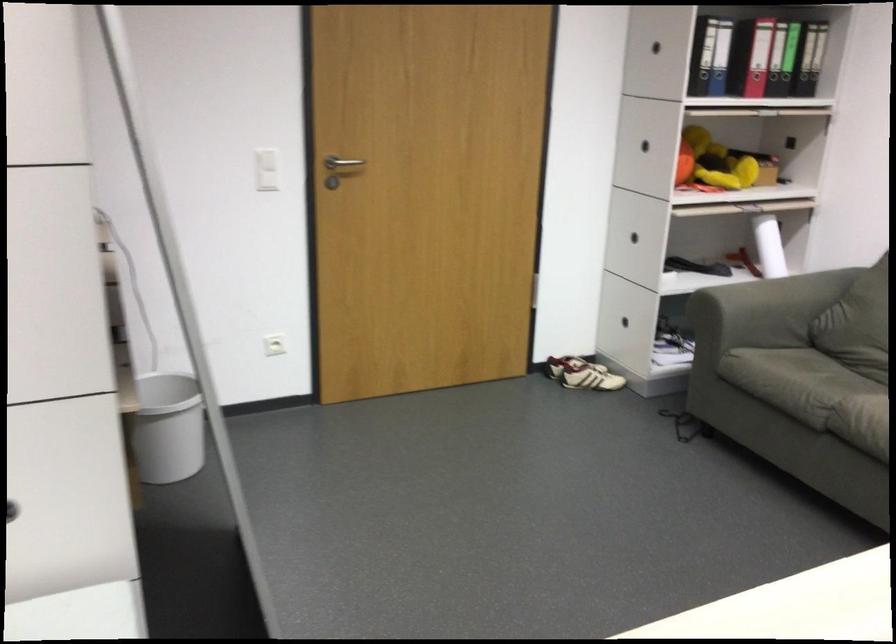
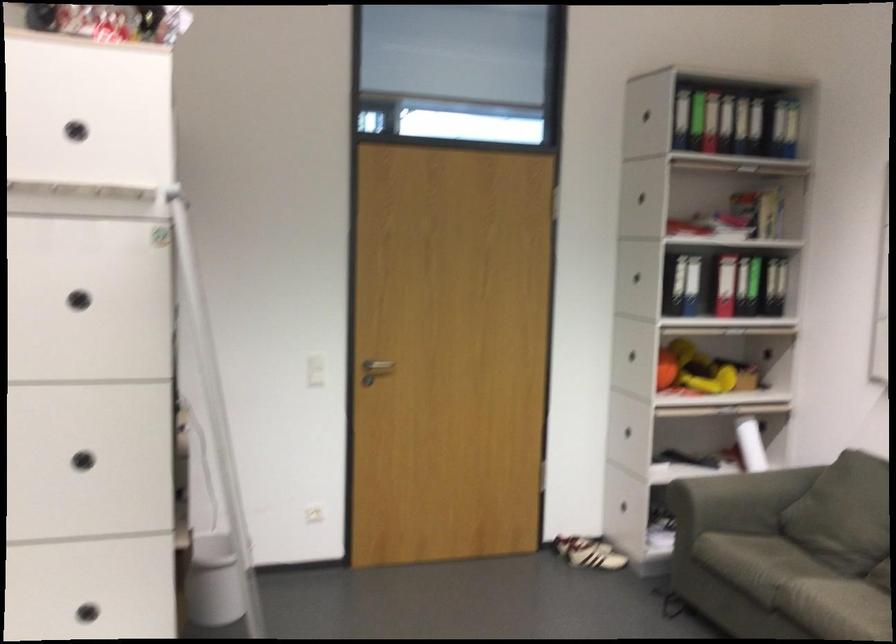
In the second image, find the point that corresponds to pixel 772 243 in the first image.

(750, 444)